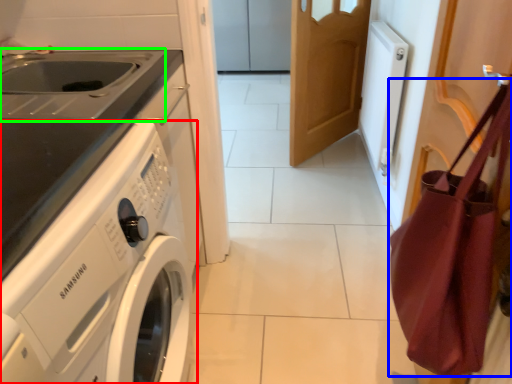
Question: Estimate the real-world distances between objects in this image. Which object is farther from washing machine (highlighted by a red box), shoulder bag (highlighted by a blue box) or sink (highlighted by a green box)?

Choices:
 (A) shoulder bag
 (B) sink

Answer: (A)